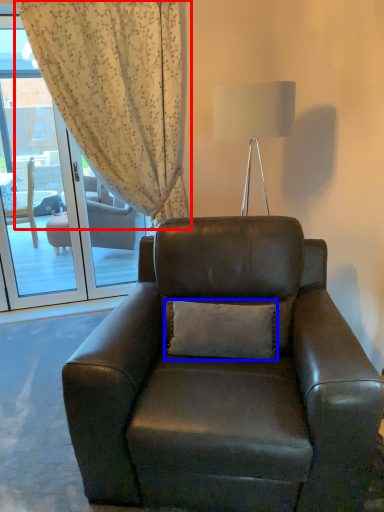
Question: Among these objects, which one is nearest to the camera, curtain (highlighted by a red box) or pillow (highlighted by a blue box)?

Choices:
 (A) curtain
 (B) pillow

Answer: (B)